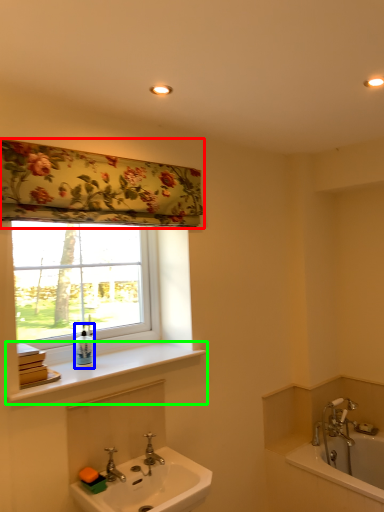
Question: Which object is positioned closest to shower curtain (highlighted by a red box)? Select from soap dispenser (highlighted by a blue box) and window sill (highlighted by a green box).

Choices:
 (A) soap dispenser
 (B) window sill

Answer: (B)